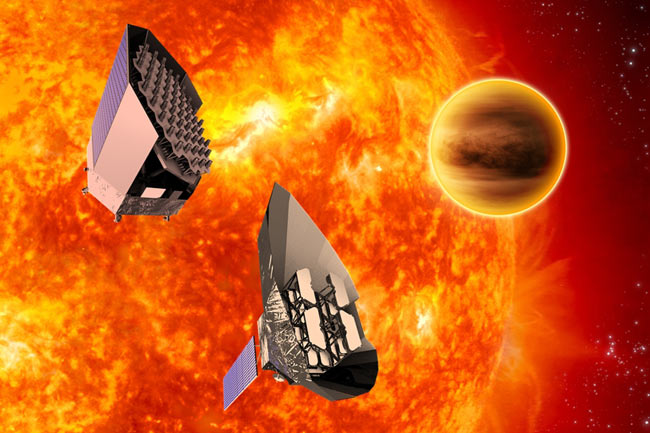
The image size is (650, 433). In order to click on gray insides of dish in this screenshot , I will do `click(296, 249)`.